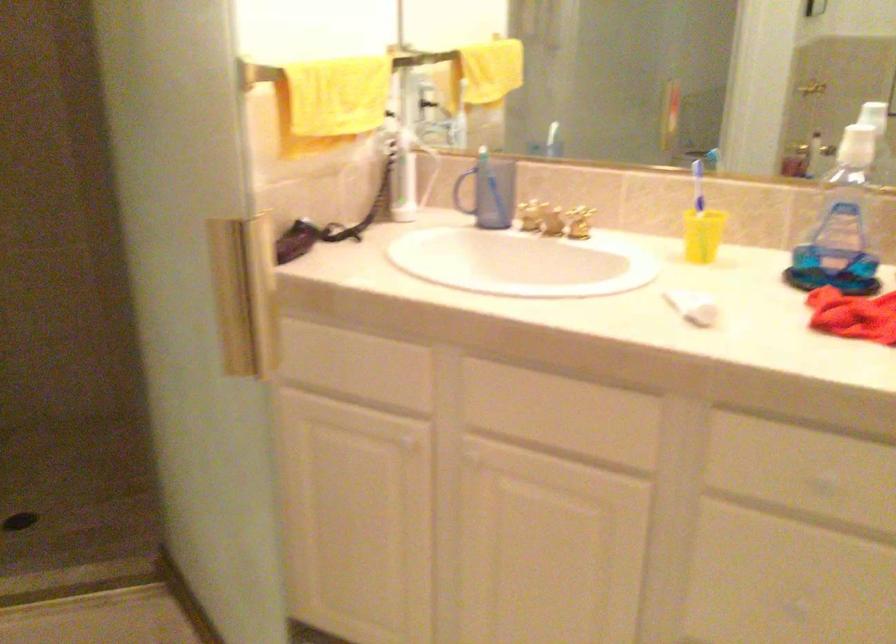
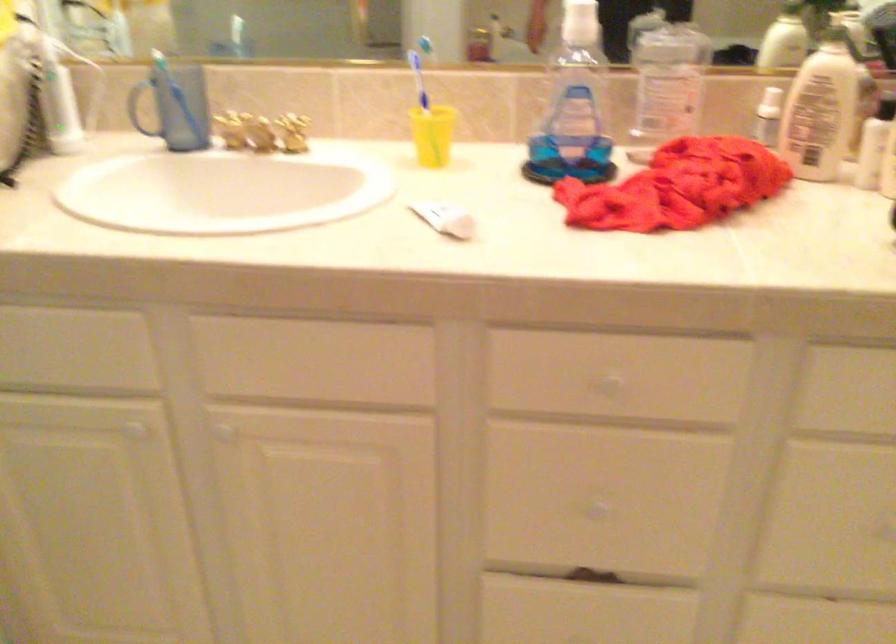
Where in the second image is the point corresponding to (x=470, y=456) from the first image?

(222, 428)